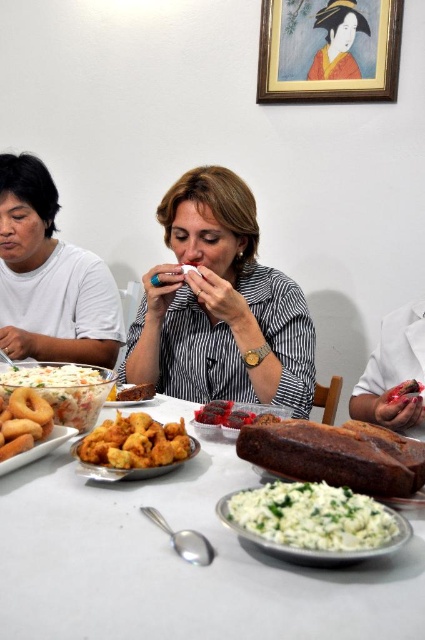
Where is `white crumbly cheese at center`? The height and width of the screenshot is (640, 425). white crumbly cheese at center is located at coordinates (312, 516).

Does white crumbly cheese at center lie in front of golden fried chicken at center?

Yes.

The height and width of the screenshot is (640, 425). What do you see at coordinates (312, 516) in the screenshot?
I see `white crumbly cheese at center` at bounding box center [312, 516].

This screenshot has width=425, height=640. In order to click on white crumbly cheese at center in this screenshot , I will do `click(312, 516)`.

Does point (376, 476) come in front of point (404, 394)?

Yes, it is in front of point (404, 394).

Does brown crusty loaf of bread at center have a greater height compared to smooth glossy meat at center?

Indeed, brown crusty loaf of bread at center has a greater height compared to smooth glossy meat at center.

What do you see at coordinates (337, 456) in the screenshot? Image resolution: width=425 pixels, height=640 pixels. I see `brown crusty loaf of bread at center` at bounding box center [337, 456].

At what (x,y) coordinates should I click in order to perform the action: click on brown crusty loaf of bread at center. Please return your answer as a coordinate pair (x, y). The image size is (425, 640). Looking at the image, I should click on (337, 456).

Is white matte plate at center bigger than white crumbly cheese at center?

Indeed, white matte plate at center has a larger size compared to white crumbly cheese at center.

The width and height of the screenshot is (425, 640). I want to click on white matte plate at center, so click(x=178, y=564).